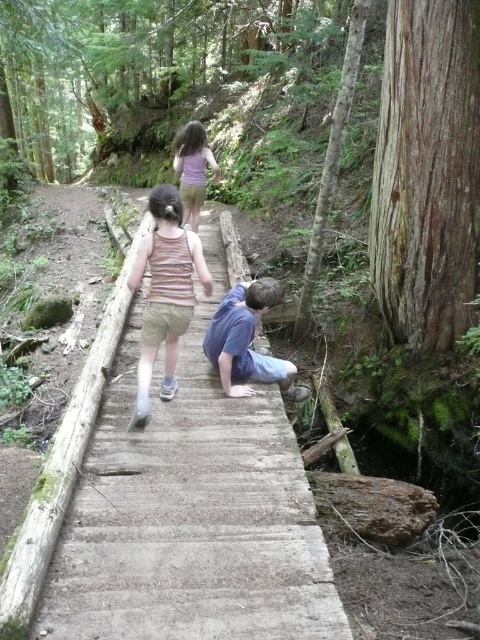
Describe the element at coordinates (165, 291) in the screenshot. I see `striped tank top at center` at that location.

Can you confirm if striped tank top at center is thinner than purple matte shirt at upper center?

No.

Is point (144, 406) more distant than point (197, 138)?

No, (144, 406) is closer to viewer.

Find the location of `striped tank top at center`. striped tank top at center is located at coordinates (165, 291).

Is striped tank top at center wider than blue cotton shirt at center?

In fact, striped tank top at center might be narrower than blue cotton shirt at center.

Is point (169, 353) positioned in front of point (247, 301)?

No, it is not.

Find the location of a particular element. striped tank top at center is located at coordinates (165, 291).

In the scene shown: Can you confirm if blue cotton shirt at center is wider than purple matte shirt at upper center?

Yes, blue cotton shirt at center is wider than purple matte shirt at upper center.

Is point (213, 326) behind point (189, 177)?

No, it is in front of (189, 177).

Find the location of `blue cotton shirt at center`. blue cotton shirt at center is located at coordinates [244, 339].